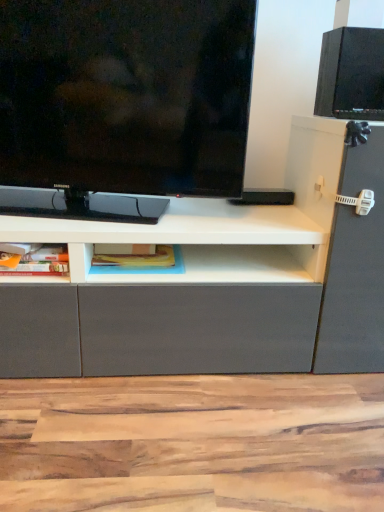
This screenshot has height=512, width=384. I want to click on free space above blue matte bookshelf at center, acting as the 2th cabinet starting from the left (from a real-world perspective), so click(x=137, y=257).